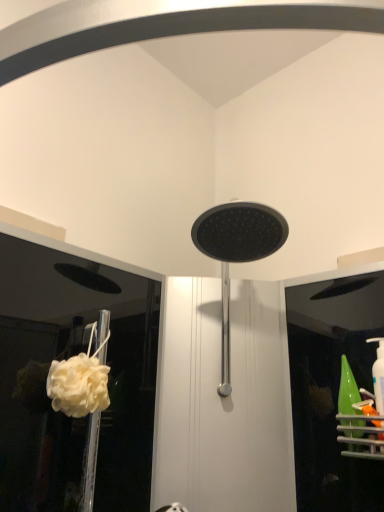
Question: Is matte black showerhead at center aimed at white fluffy sponge at lower left?

Choices:
 (A) yes
 (B) no

Answer: (B)

Question: Is matte black showerhead at center not close to white fluffy sponge at lower left?

Choices:
 (A) yes
 (B) no

Answer: (B)

Question: Does matte black showerhead at center have a smaller size compared to white fluffy sponge at lower left?

Choices:
 (A) no
 (B) yes

Answer: (A)

Question: Is matte black showerhead at center further to the viewer compared to white fluffy sponge at lower left?

Choices:
 (A) no
 (B) yes

Answer: (A)

Question: Does matte black showerhead at center have a lesser width compared to white fluffy sponge at lower left?

Choices:
 (A) yes
 (B) no

Answer: (B)

Question: Can you confirm if matte black showerhead at center is bigger than white fluffy sponge at lower left?

Choices:
 (A) yes
 (B) no

Answer: (A)

Question: Is white fluffy sponge at lower left wider than matte black showerhead at center?

Choices:
 (A) no
 (B) yes

Answer: (A)

Question: From a real-world perspective, is white fluffy sponge at lower left positioned over matte black showerhead at center based on gravity?

Choices:
 (A) no
 (B) yes

Answer: (A)

Question: Considering the relative sizes of white fluffy sponge at lower left and matte black showerhead at center in the image provided, is white fluffy sponge at lower left smaller than matte black showerhead at center?

Choices:
 (A) no
 (B) yes

Answer: (B)

Question: Does white fluffy sponge at lower left have a larger size compared to matte black showerhead at center?

Choices:
 (A) yes
 (B) no

Answer: (B)

Question: Could you tell me if white fluffy sponge at lower left is facing matte black showerhead at center?

Choices:
 (A) no
 (B) yes

Answer: (A)

Question: Is white fluffy sponge at lower left taller than matte black showerhead at center?

Choices:
 (A) yes
 (B) no

Answer: (B)

Question: Considering their positions, is matte black showerhead at center located in front of or behind white fluffy sponge at lower left?

Choices:
 (A) front
 (B) behind

Answer: (A)